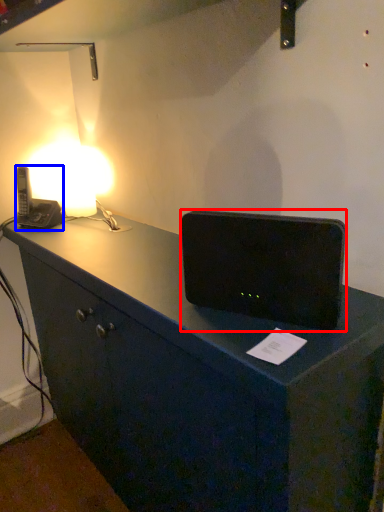
Question: Which object is further to the camera taking this photo, loudspeaker (highlighted by a red box) or gadget (highlighted by a blue box)?

Choices:
 (A) loudspeaker
 (B) gadget

Answer: (B)